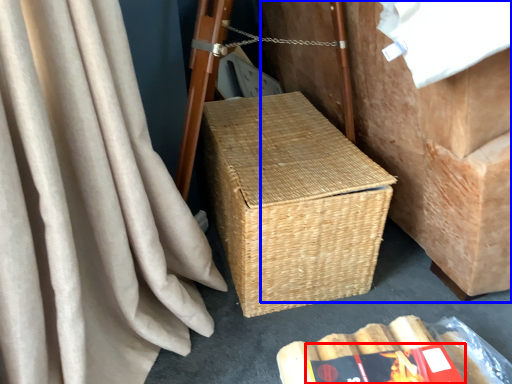
Question: Among these objects, which one is nearest to the camera, paperback book (highlighted by a red box) or furniture (highlighted by a blue box)?

Choices:
 (A) paperback book
 (B) furniture

Answer: (B)